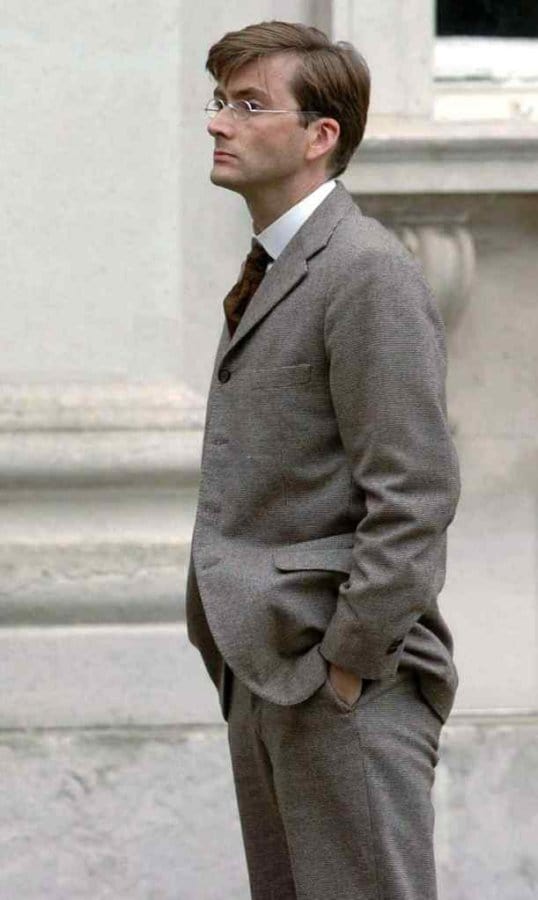
This screenshot has height=900, width=538. What are the coordinates of `window ledge` in the screenshot? It's located at (455, 171).